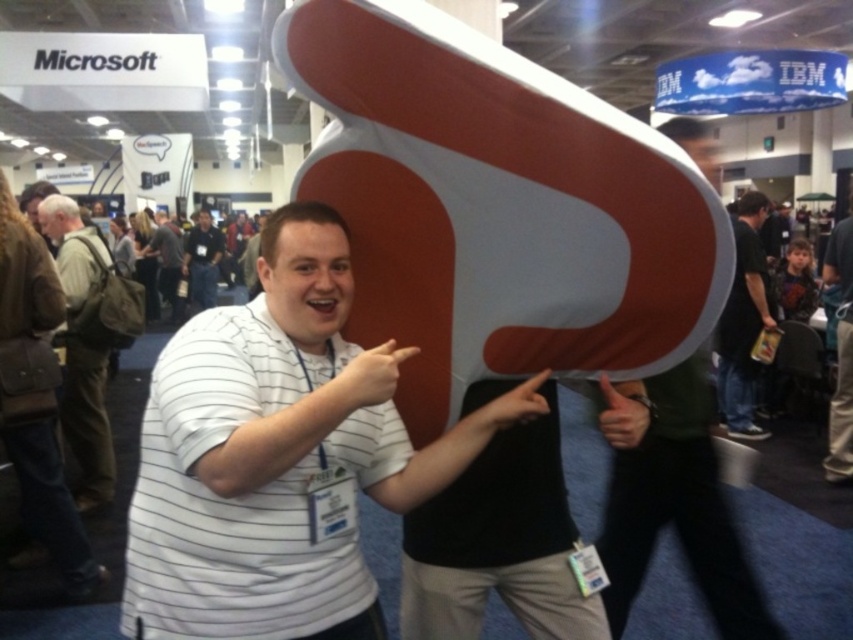
Is black fabric bag at right positioned in front of striped cotton shirt at center?

Yes, black fabric bag at right is in front of striped cotton shirt at center.

Is point (738, 243) less distant than point (178, 316)?

Yes, point (738, 243) is in front of point (178, 316).

You are a GUI agent. You are given a task and a screenshot of the screen. Output one action in this format:
    pyautogui.click(x=<x>, y=<y>)
    Task: Click on the black fabric bag at right
    
    Given the screenshot: What is the action you would take?
    pyautogui.click(x=743, y=321)

Describe the element at coordinates (279, 456) in the screenshot. I see `white striped shirt at center` at that location.

Between point (305, 323) and point (833, 280), which one is positioned in front?

Point (305, 323) is more forward.

Is point (357, 547) behind point (848, 220)?

No.

The height and width of the screenshot is (640, 853). Identify the location of white striped shirt at center. (279, 456).

Is white striped shirt at center thinner than matte black shirt at center?

No.

Can you confirm if white striped shirt at center is taller than matte black shirt at center?

No.

Where is `white striped shirt at center`? The image size is (853, 640). white striped shirt at center is located at coordinates (279, 456).

At what (x,y) coordinates should I click in order to perform the action: click on white striped shirt at center. Please return your answer as a coordinate pair (x, y). Looking at the image, I should click on (279, 456).